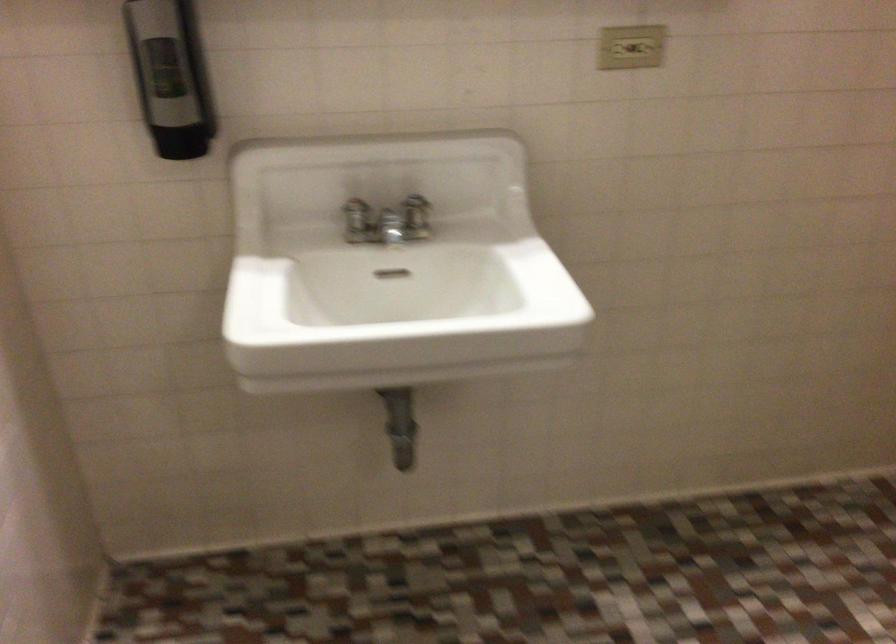
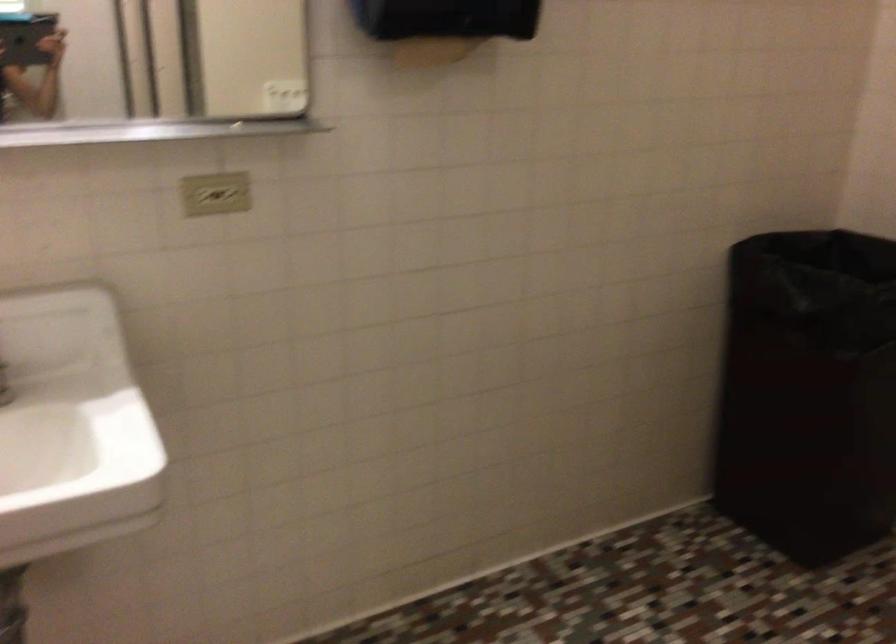
Question: How did the camera likely rotate?

Choices:
 (A) Left
 (B) Right
 (C) Up
 (D) Down

Answer: (B)